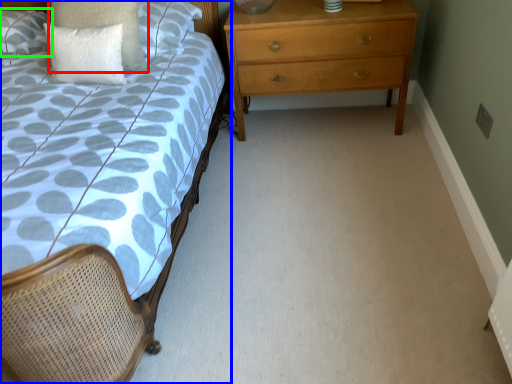
Question: Estimate the real-world distances between objects in this image. Which object is closer to pillow (highlighted by a red box), bed (highlighted by a blue box) or pillow (highlighted by a green box)?

Choices:
 (A) bed
 (B) pillow

Answer: (B)